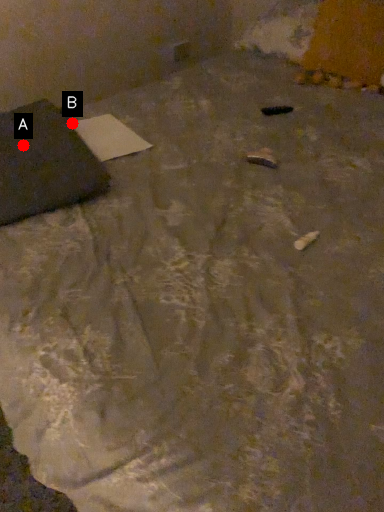
Question: Two points are circled on the image, labeled by A and B beside each circle. Which point is farther to the camera?

Choices:
 (A) A is further
 (B) B is further

Answer: (B)